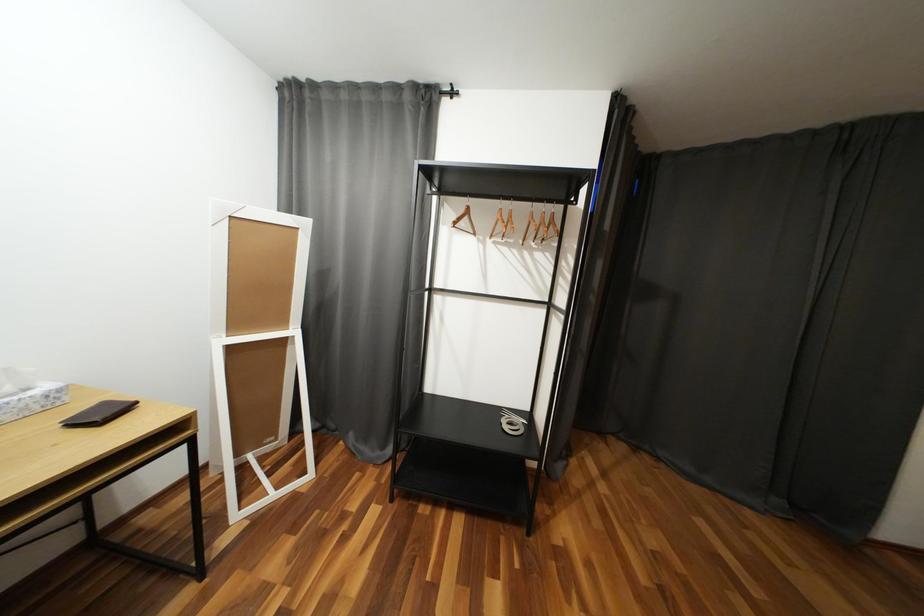
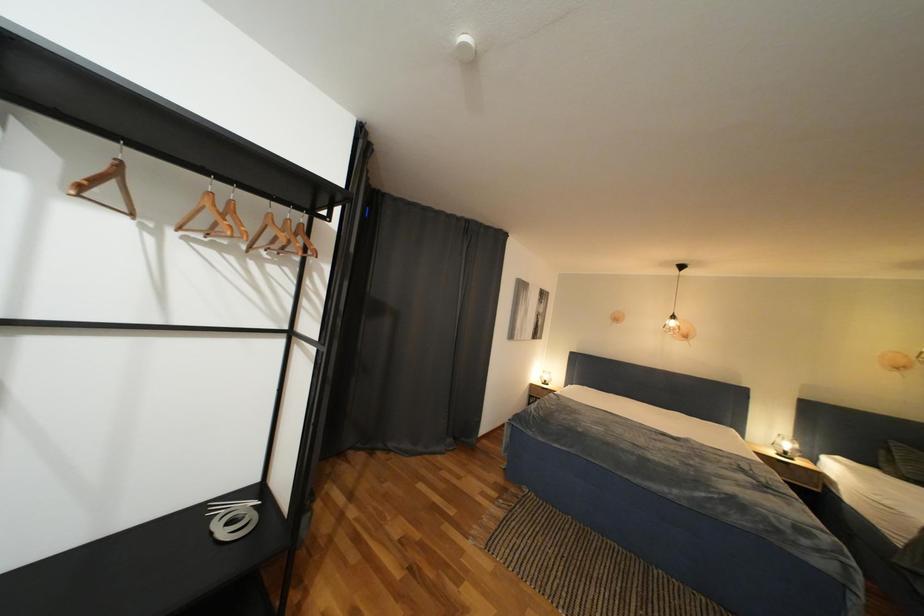
Question: The images are taken continuously from a first-person perspective. In which direction is your viewpoint rotating?

Choices:
 (A) Left
 (B) Right
 (C) Up
 (D) Down

Answer: (B)